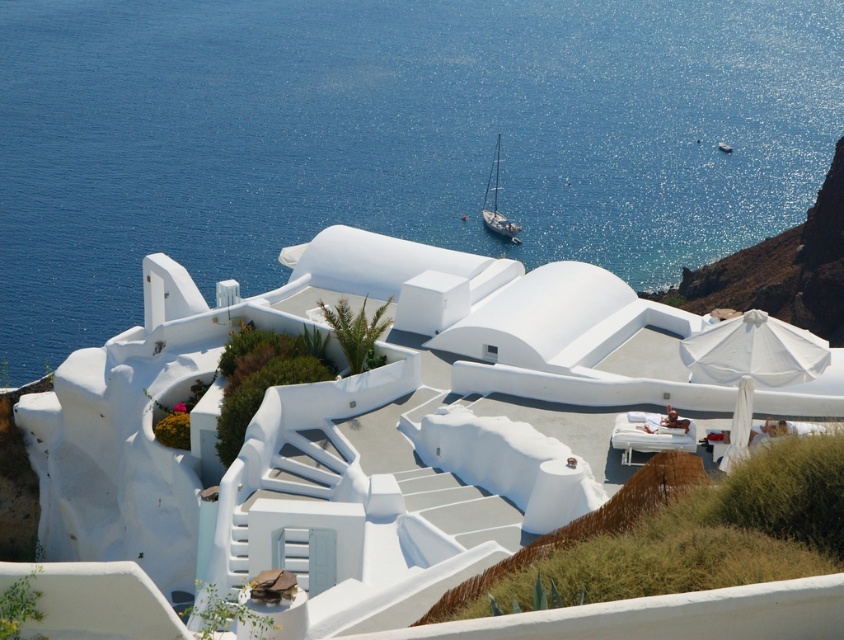
Question: Does blue water at center appear over blue glossy sailboat at center?

Choices:
 (A) no
 (B) yes

Answer: (B)

Question: Among these objects, which one is farthest from the camera?

Choices:
 (A) blue glossy sailboat at center
 (B) blue water at center

Answer: (A)

Question: Does blue water at center come behind blue glossy sailboat at center?

Choices:
 (A) yes
 (B) no

Answer: (B)

Question: Is blue water at center bigger than blue glossy sailboat at center?

Choices:
 (A) no
 (B) yes

Answer: (B)

Question: Which point is farther to the camera?

Choices:
 (A) blue water at center
 (B) blue glossy sailboat at center

Answer: (B)